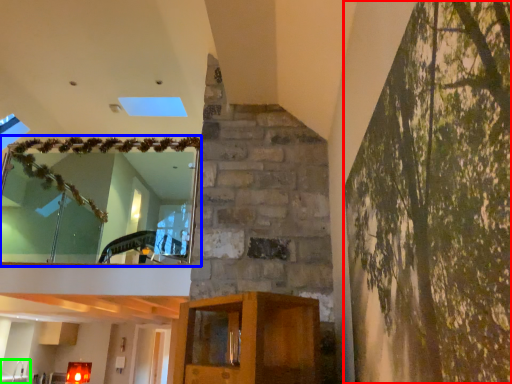
Question: Estimate the real-world distances between objects in this image. Which object is closer to tree (highlighted by a red box), window (highlighted by a blue box) or sink (highlighted by a green box)?

Choices:
 (A) window
 (B) sink

Answer: (A)